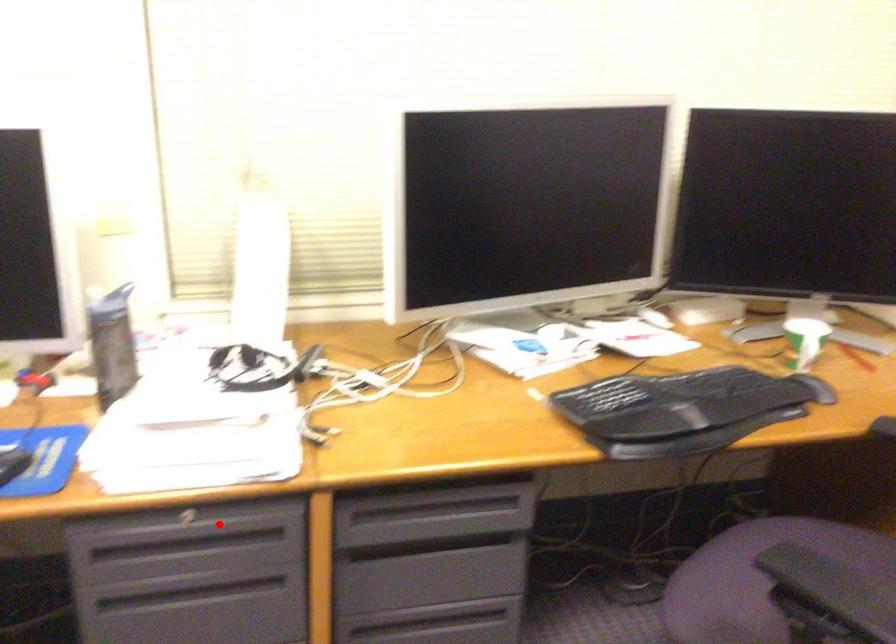
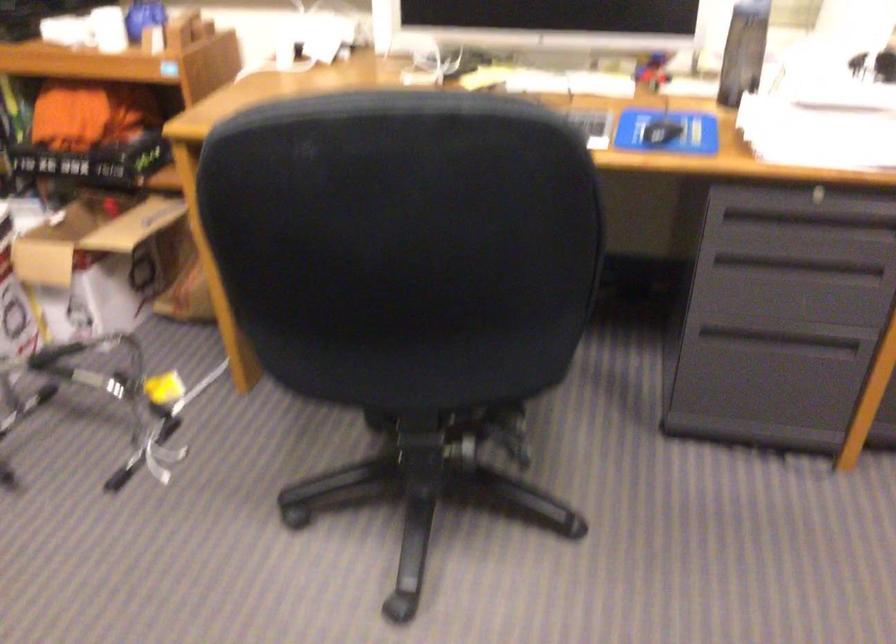
Find the pixel in the second image that matches the highlighted location in the first image.

(840, 200)